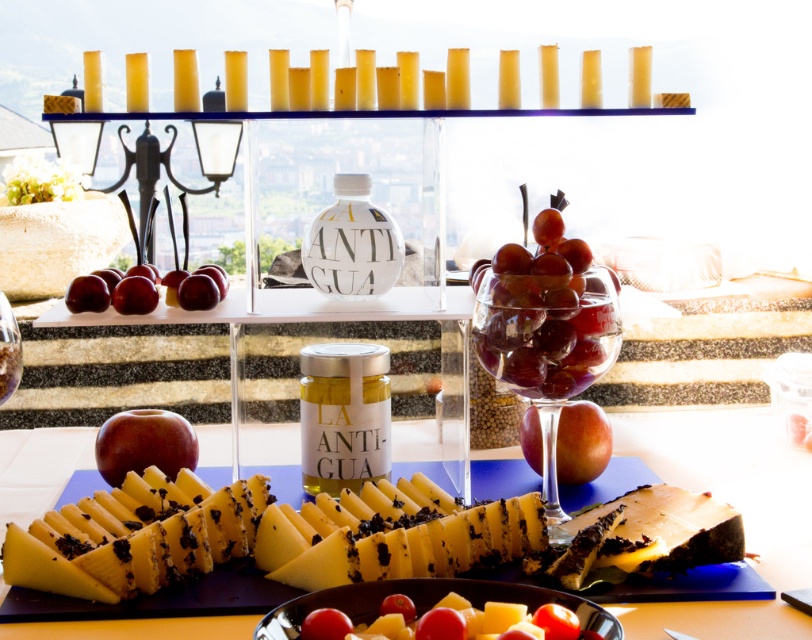
Consider the image. Does glossy glass grapes at center come in front of red matte apple at lower left?

Yes, glossy glass grapes at center is in front of red matte apple at lower left.

Identify the location of glossy glass grapes at center. The width and height of the screenshot is (812, 640). (546, 316).

This screenshot has width=812, height=640. In order to click on glossy glass grapes at center in this screenshot , I will do `click(546, 316)`.

Where is `glossy glass grapes at center`? glossy glass grapes at center is located at coordinates (546, 316).

Between glossy glass grapes at center and translucent glass wine at lower left, which one appears on the left side from the viewer's perspective?

Positioned to the left is translucent glass wine at lower left.

Can you confirm if glossy glass grapes at center is bigger than translucent glass wine at lower left?

Yes, glossy glass grapes at center is bigger than translucent glass wine at lower left.

Locate an element on the screen. The height and width of the screenshot is (640, 812). glossy glass grapes at center is located at coordinates (546, 316).

Can you confirm if yellow cheese at center is positioned to the left of red matte apple at center?

Correct, you'll find yellow cheese at center to the left of red matte apple at center.

Is yellow cheese at center to the right of red matte apple at center from the viewer's perspective?

No, yellow cheese at center is not to the right of red matte apple at center.

Is point (806, 499) farther from camera compared to point (594, 444)?

No, (806, 499) is closer to viewer.

In order to click on yellow cheese at center in this screenshot , I will do `click(735, 508)`.